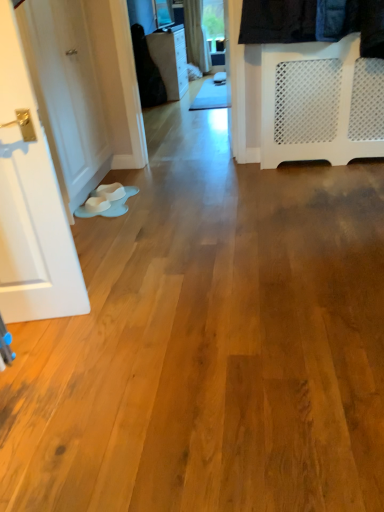
Locate an element on the screen. The height and width of the screenshot is (512, 384). white painted wood door at left is located at coordinates (66, 94).

Image resolution: width=384 pixels, height=512 pixels. Describe the element at coordinates (287, 97) in the screenshot. I see `white mesh gate at right` at that location.

Image resolution: width=384 pixels, height=512 pixels. What are the coordinates of `matte black dresser at upper center` in the screenshot? It's located at (170, 59).

Consider the image. Considering the positions of objects matte black dresser at upper center and black fabric at upper left in the image provided, who is behind, matte black dresser at upper center or black fabric at upper left?

matte black dresser at upper center is more distant.

Which is more distant, (x=173, y=36) or (x=141, y=75)?

Positioned behind is point (x=173, y=36).

Is matte black dresser at upper center situated inside black fabric at upper left or outside?

matte black dresser at upper center is not enclosed by black fabric at upper left.

Is matte black dresser at upper center thinner than black fabric at upper left?

No.

Considering the relative sizes of black fabric at upper left and matte black dresser at upper center in the image provided, is black fabric at upper left shorter than matte black dresser at upper center?

No, black fabric at upper left is not shorter than matte black dresser at upper center.

Is black fabric at upper left oriented away from matte black dresser at upper center?

No, black fabric at upper left is not facing away from matte black dresser at upper center.

Between black fabric at upper left and matte black dresser at upper center, which one has smaller width?

With smaller width is black fabric at upper left.

From the image's perspective, between black fabric at upper left and matte black dresser at upper center, who is located below?

black fabric at upper left appears lower in the image.

Between white painted wood door at left and black fabric at upper left, which one has less height?

black fabric at upper left.

From the image's perspective, would you say white painted wood door at left is shown under black fabric at upper left?

Yes.

Is point (55, 69) positioned in front of point (135, 61)?

Yes.

Is black fabric at upper left taller than white mesh gate at right?

Correct, black fabric at upper left is much taller as white mesh gate at right.

Is black fabric at upper left surrounding white mesh gate at right?

Definitely not — white mesh gate at right is not inside black fabric at upper left.

In the scene shown: Between black fabric at upper left and white mesh gate at right, which one appears on the left side from the viewer's perspective?

black fabric at upper left.

Between black fabric at upper left and white mesh gate at right, which one has larger size?

white mesh gate at right is bigger.

Measure the distance between black fabric at upper left and white painted wood door at left.

black fabric at upper left is 2.42 meters away from white painted wood door at left.

Is black fabric at upper left facing towards white painted wood door at left?

No, black fabric at upper left is not turned towards white painted wood door at left.

Is black fabric at upper left wider than white painted wood door at left?

Correct, the width of black fabric at upper left exceeds that of white painted wood door at left.

Consider the image. Is black fabric at upper left outside of white painted wood door at left?

black fabric at upper left lies outside white painted wood door at left's area.

Are white mesh gate at right and matte black dresser at upper center beside each other?

No, white mesh gate at right is not with matte black dresser at upper center.

How many degrees apart are the facing directions of white mesh gate at right and matte black dresser at upper center?

white mesh gate at right and matte black dresser at upper center are facing 89.6 degrees away from each other.

Does white mesh gate at right turn towards matte black dresser at upper center?

No, white mesh gate at right is not facing towards matte black dresser at upper center.

Which object is closer to the camera, white mesh gate at right or matte black dresser at upper center?

white mesh gate at right is more forward.

Considering the relative sizes of matte black dresser at upper center and white mesh gate at right in the image provided, is matte black dresser at upper center taller than white mesh gate at right?

Yes.

Which object is positioned more to the left, matte black dresser at upper center or white mesh gate at right?

matte black dresser at upper center is more to the left.

Considering their positions, is matte black dresser at upper center located in front of or behind white mesh gate at right?

matte black dresser at upper center is positioned farther from the viewer than white mesh gate at right.

Would you consider matte black dresser at upper center to be distant from white mesh gate at right?

Absolutely, matte black dresser at upper center is distant from white mesh gate at right.

Find the location of a particular element. The height and width of the screenshot is (512, 384). clothing above the matte black dresser at upper center (from a real-world perspective) is located at coordinates pos(147,71).

This screenshot has height=512, width=384. In order to click on furniture on the right of black fabric at upper left in this screenshot , I will do `click(170, 59)`.

Considering their positions, is white mesh gate at right positioned further to matte black dresser at upper center than white painted wood door at left?

Based on the image, white mesh gate at right appears to be further to matte black dresser at upper center.

Looking at the image, which one is located further to white painted wood door at left, black fabric at upper left or matte black dresser at upper center?

matte black dresser at upper center.

Estimate the real-world distances between objects in this image. Which object is closer to black fabric at upper left, white painted wood door at left or matte black dresser at upper center?

Among the two, matte black dresser at upper center is located nearer to black fabric at upper left.

Which object lies nearer to the anchor point white mesh gate at right, black fabric at upper left or matte black dresser at upper center?

Based on the image, black fabric at upper left appears to be nearer to white mesh gate at right.

Looking at the image, which one is located further to matte black dresser at upper center, white mesh gate at right or black fabric at upper left?

white mesh gate at right is further to matte black dresser at upper center.

Which object lies nearer to the anchor point white mesh gate at right, matte black dresser at upper center or white painted wood door at left?

white painted wood door at left is closer to white mesh gate at right.

Based on their spatial positions, is white mesh gate at right or matte black dresser at upper center closer to white painted wood door at left?

white mesh gate at right is closer to white painted wood door at left.

Estimate the real-world distances between objects in this image. Which object is closer to white painted wood door at left, white mesh gate at right or black fabric at upper left?

white mesh gate at right.

At what (x,y) coordinates should I click in order to perform the action: click on clothing between white mesh gate at right and matte black dresser at upper center from front to back. Please return your answer as a coordinate pair (x, y). The height and width of the screenshot is (512, 384). Looking at the image, I should click on (147, 71).

This screenshot has height=512, width=384. In order to click on clothing between white painted wood door at left and matte black dresser at upper center in the front-back direction in this screenshot , I will do `click(147, 71)`.

This screenshot has height=512, width=384. In order to click on closet between white painted wood door at left and matte black dresser at upper center in the front-back direction in this screenshot , I will do (287, 97).

Locate an element on the screen. The height and width of the screenshot is (512, 384). closet located between white painted wood door at left and black fabric at upper left in the depth direction is located at coordinates (287, 97).